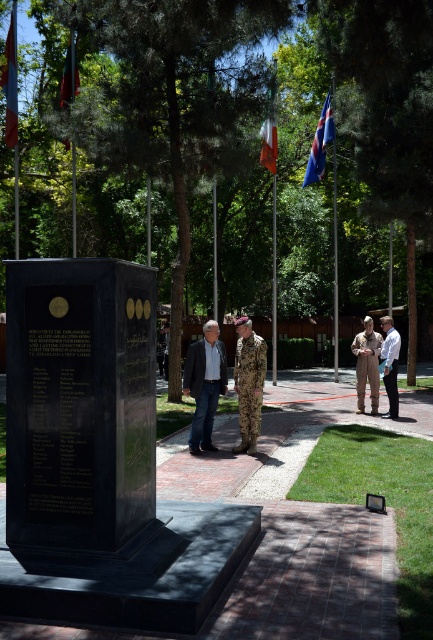
You are a photographer positioned to the left of the memorial monument. You want to capture a photo that includes both the camouflage fabric uniform at center and the blue fabric flag at upper center. Which object should you adjust your camera angle to include first if the flag is partially blocking the view of the uniform?

The blue fabric flag at upper center is blocking the view of the camouflage fabric uniform at center. To include both in the photo, adjust the camera angle to first position the camouflage fabric uniform at center so it is not obscured by the flag.

You are a visitor at the memorial and want to take a photo that includes both the red fabric flag at upper left and the green fabric flag at upper left. Which flag should you position closer to the center of your photo to ensure both are visible?

The red fabric flag at upper left is bigger than the green fabric flag at upper left, so to ensure both are visible in your photo, you should position the smaller green fabric flag at upper left closer to the center to balance their sizes.

You are standing at the entrance of the memorial and want to locate the camouflage fabric uniform at center. According to the coordinates provided, in which direction should you look relative to your current position?

You should look towards the center of the image, as the camouflage fabric uniform at center is located at point [248,381], which corresponds to the central area.